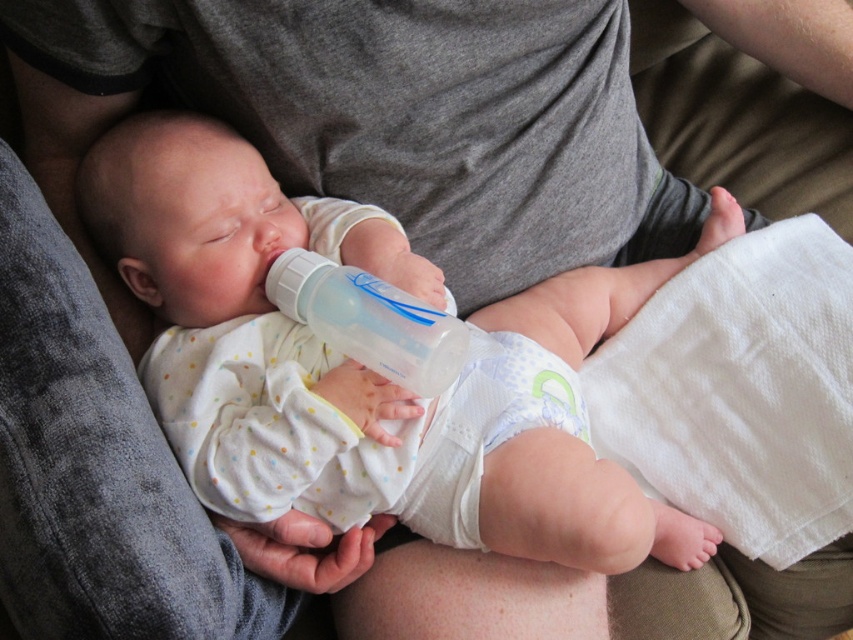
Does white soft baby bottle at center appear over transparent plastic baby bottle at center?

Correct, white soft baby bottle at center is located above transparent plastic baby bottle at center.

Which is more to the left, white soft baby bottle at center or transparent plastic baby bottle at center?

Positioned to the left is transparent plastic baby bottle at center.

Between point (184, 156) and point (300, 250), which one is positioned in front?

Positioned in front is point (184, 156).

At what (x,y) coordinates should I click in order to perform the action: click on white soft baby bottle at center. Please return your answer as a coordinate pair (x, y). Image resolution: width=853 pixels, height=640 pixels. Looking at the image, I should click on point(367,369).

Can you confirm if white soft diaper at center is positioned to the right of transparent plastic baby bottle at center?

Yes, white soft diaper at center is to the right of transparent plastic baby bottle at center.

Does white soft diaper at center appear over transparent plastic baby bottle at center?

No, white soft diaper at center is not above transparent plastic baby bottle at center.

Is point (509, 384) closer to camera compared to point (378, 337)?

No.

Find the location of a particular element. Image resolution: width=853 pixels, height=640 pixels. white soft diaper at center is located at coordinates (485, 429).

Is white soft baby bottle at center below white soft diaper at center?

Actually, white soft baby bottle at center is above white soft diaper at center.

How much distance is there between white soft baby bottle at center and white soft diaper at center?

white soft baby bottle at center and white soft diaper at center are 3.65 inches apart from each other.

Between point (537, 376) and point (471, 388), which one is positioned behind?

The point (537, 376) is more distant.

Where is `white soft baby bottle at center`? white soft baby bottle at center is located at coordinates (367, 369).